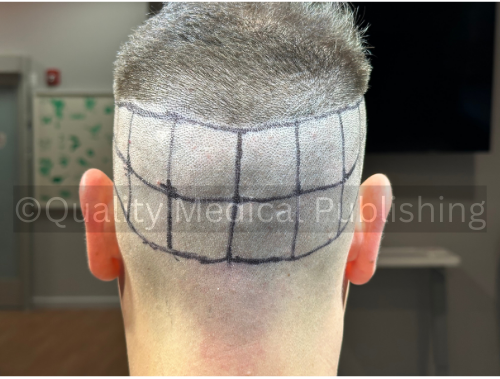
Where is `table legs`? The image size is (500, 379). table legs is located at coordinates (437, 322), (421, 322).